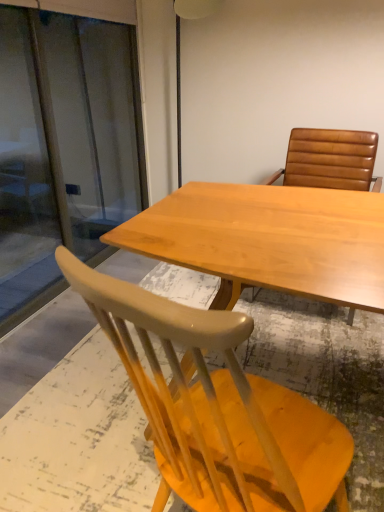
Where is `vacant point above light wood table at center (from a real-world perspective)`? vacant point above light wood table at center (from a real-world perspective) is located at coordinates (267, 222).